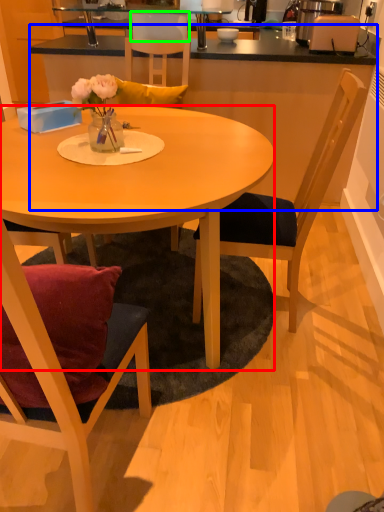
Question: Which is farther away from desk (highlighted by a red box)? counter top (highlighted by a blue box) or armchair (highlighted by a green box)?

Choices:
 (A) counter top
 (B) armchair

Answer: (B)